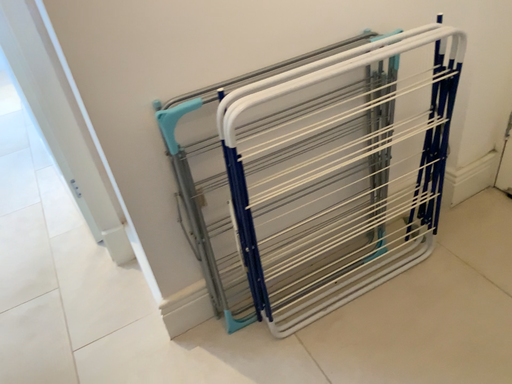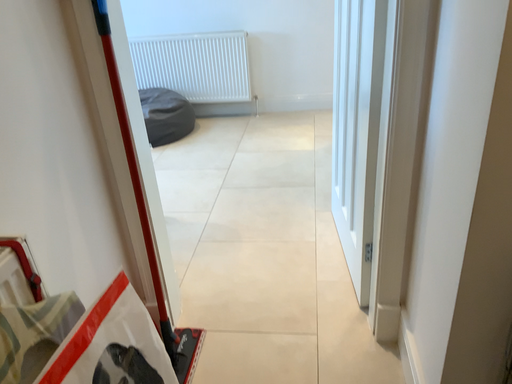
Question: Which way did the camera rotate in the video?

Choices:
 (A) rotated left
 (B) rotated right

Answer: (A)